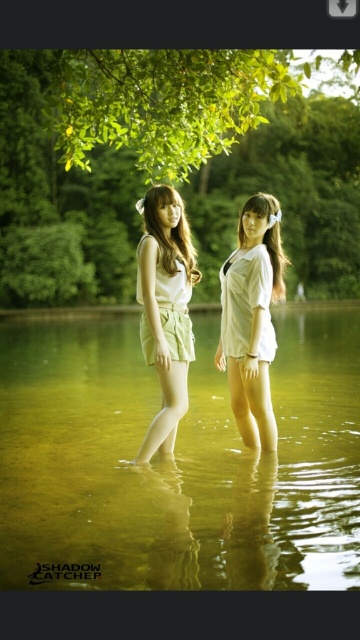
Can you confirm if white matte shirt at center is positioned to the left of light green cotton shorts at center?

In fact, white matte shirt at center is to the right of light green cotton shorts at center.

Looking at this image, is white matte shirt at center smaller than light green cotton shorts at center?

No.

Measure the distance between white matte shirt at center and camera.

white matte shirt at center is 7.00 meters away from camera.

You are a GUI agent. You are given a task and a screenshot of the screen. Output one action in this format:
    pyautogui.click(x=<x>, y=<y>)
    Task: Click on the white matte shirt at center
    
    Given the screenshot: What is the action you would take?
    pyautogui.click(x=251, y=320)

Is clear water at center shorter than white matte shirt at center?

Yes, clear water at center is shorter than white matte shirt at center.

Can you confirm if clear water at center is positioned to the right of white matte shirt at center?

Incorrect, clear water at center is not on the right side of white matte shirt at center.

Does point (27, 433) come farther from viewer compared to point (248, 200)?

Yes, point (27, 433) is farther from viewer.

Image resolution: width=360 pixels, height=640 pixels. Identify the location of clear water at center. (177, 461).

Does clear water at center lie in front of light green cotton shorts at center?

Yes, it is in front of light green cotton shorts at center.

Between point (114, 497) and point (153, 209), which one is positioned behind?

Positioned behind is point (153, 209).

Find the location of a particular element. Image resolution: width=360 pixels, height=640 pixels. clear water at center is located at coordinates (177, 461).